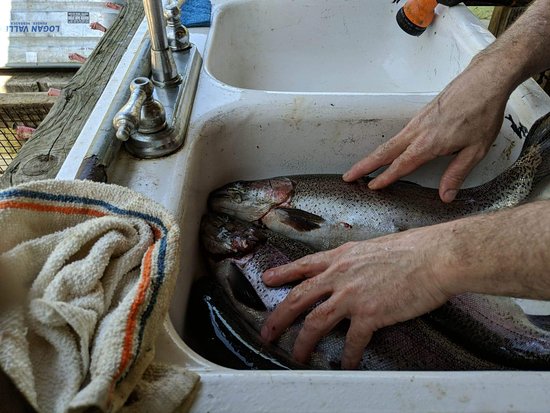
Locate an element on the screen. sink is located at coordinates (320, 164), (276, 60).